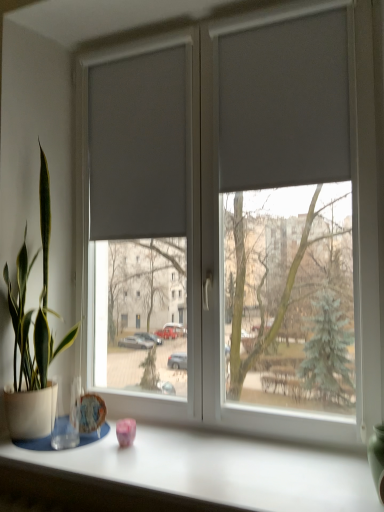
You are a GUI agent. You are given a task and a screenshot of the screen. Output one action in this format:
    pyautogui.click(x=<x>, y=<y>)
    Task: Click on the spots to the right of green glossy plant at left
    
    Given the screenshot: What is the action you would take?
    pyautogui.click(x=117, y=446)